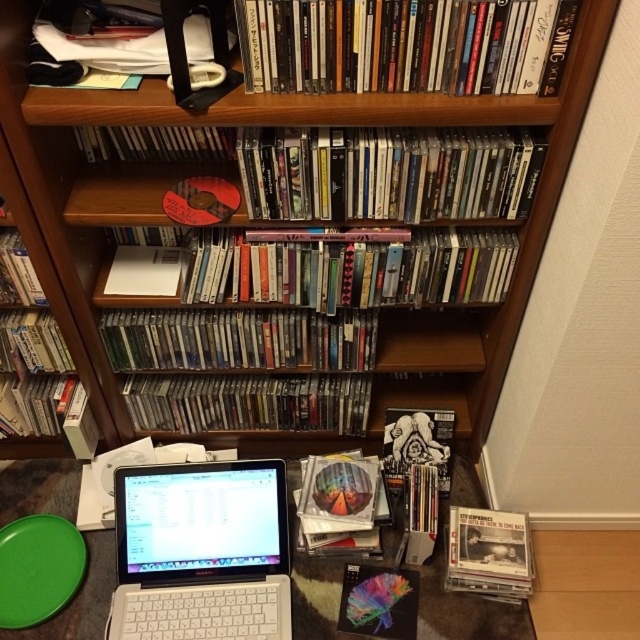
Question: Estimate the real-world distances between objects in this image. Which object is closer to the green matte plate at lower left?

Choices:
 (A) sleek plastic cds at center
 (B) white paper at center
 (C) matte black bookshelf at upper center

Answer: (A)

Question: Can you confirm if matte plastic books at upper center is positioned to the right of matte paper book at center?

Choices:
 (A) yes
 (B) no

Answer: (A)

Question: Where is wooden bookcase at upper center located in relation to sleek plastic cds at center in the image?

Choices:
 (A) left
 (B) right

Answer: (A)

Question: Is matte paper book at center positioned behind matte black bookshelf at upper center?

Choices:
 (A) yes
 (B) no

Answer: (A)

Question: Which of the following is the closest to the observer?

Choices:
 (A) white paper at center
 (B) matte black book at upper left
 (C) matte brown cd at upper center
 (D) matte white book at left

Answer: (C)

Question: Which point is closer to the camera taking this photo?

Choices:
 (A) coord(147,273)
 (B) coord(260,536)
 (C) coord(240,195)
 (D) coord(339,13)

Answer: (D)